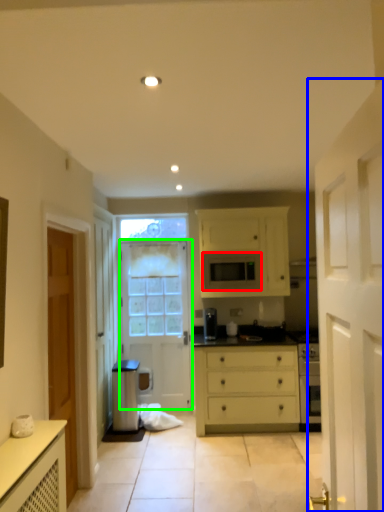
Question: Which object is the closest to the microwave oven (highlighted by a red box)? Choose among these: door (highlighted by a blue box) or door (highlighted by a green box).

Choices:
 (A) door
 (B) door

Answer: (B)